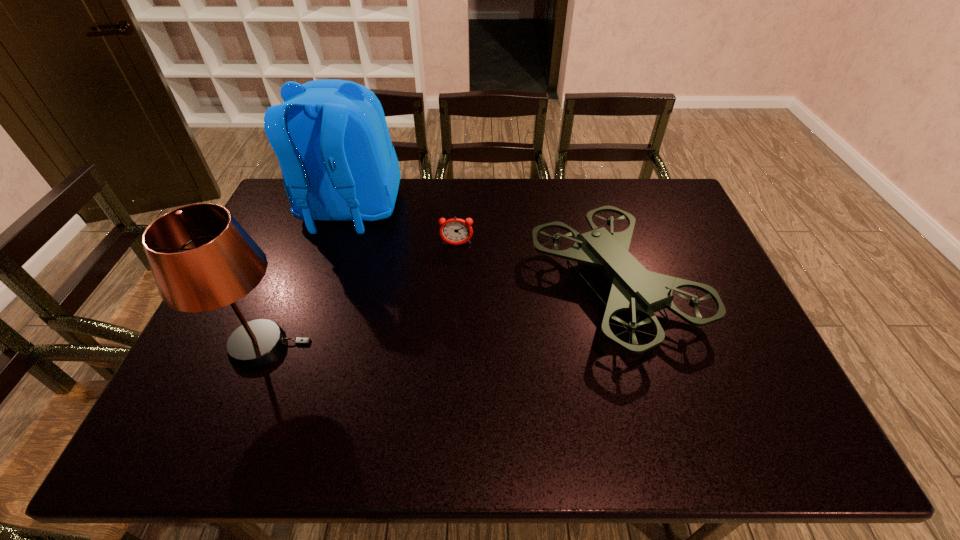
The width and height of the screenshot is (960, 540). What are the coordinates of `object situated at the far edge` in the screenshot? It's located at (331, 138).

Identify the location of backpack located at the left edge. This screenshot has height=540, width=960. (331, 138).

Identify the location of lampshade located at the left edge. (201, 258).

The width and height of the screenshot is (960, 540). In order to click on object that is at the right edge in this screenshot , I will do `click(634, 288)`.

Locate an element on the screen. This screenshot has height=540, width=960. object that is positioned at the far left corner is located at coordinates (331, 138).

Identify the location of vacant space at the far edge. The image size is (960, 540). (544, 194).

Identify the location of free spot at the left edge of the desktop. The width and height of the screenshot is (960, 540). (214, 399).

Locate an element on the screen. vacant area at the right edge of the desktop is located at coordinates (708, 248).

The height and width of the screenshot is (540, 960). I want to click on vacant region at the near right corner of the desktop, so click(x=744, y=420).

This screenshot has height=540, width=960. Find the location of `vacant region between the second object from right to left and the lampshade`. vacant region between the second object from right to left and the lampshade is located at coordinates (360, 295).